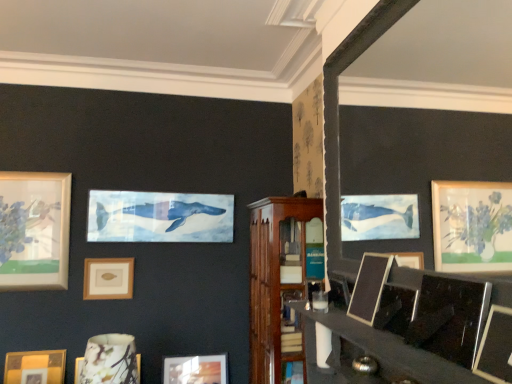
Question: Choose the correct answer: Is matte ceramic vase at lower left, arranged as the 3th picture frame when viewed from the back, inside wooden picture frame at center, the 3th picture frame in the right-to-left sequence, or outside it?

Choices:
 (A) outside
 (B) inside

Answer: (A)

Question: In terms of width, does matte ceramic vase at lower left, acting as the third picture frame starting from the left, look wider or thinner when compared to wooden picture frame at center, which is counted as the 5th picture frame, starting from the left?

Choices:
 (A) thin
 (B) wide

Answer: (A)

Question: Which object is the farthest from the matte wooden picture frame at lower center, the sixth picture frame in the front-to-back sequence?

Choices:
 (A) wooden cabinet at center
 (B) matte gold picture frame at center-left, which is counted as the 1th picture frame, starting from the back
 (C) matte ceramic vase at lower left, acting as the third picture frame starting from the left
 (D) metallic silver picture frame at lower right, acting as the seventh picture frame starting from the back
 (E) shiny black picture frame at lower right, the sixth picture frame when ordered from left to right

Answer: (D)

Question: Which object is positioned closest to the wooden picture frame at center, arranged as the fifth picture frame when viewed from the back?

Choices:
 (A) wooden cabinet at center
 (B) matte gold picture frame at lower left, which ranks as the 4th picture frame in front-to-back order
 (C) matte gold picture frame at center-left, acting as the 7th picture frame starting from the front
 (D) shiny black picture frame at lower right, which is the 2th picture frame from right to left
 (E) matte wooden picture frame at lower center, marked as the fourth picture frame in a left-to-right arrangement

Answer: (D)